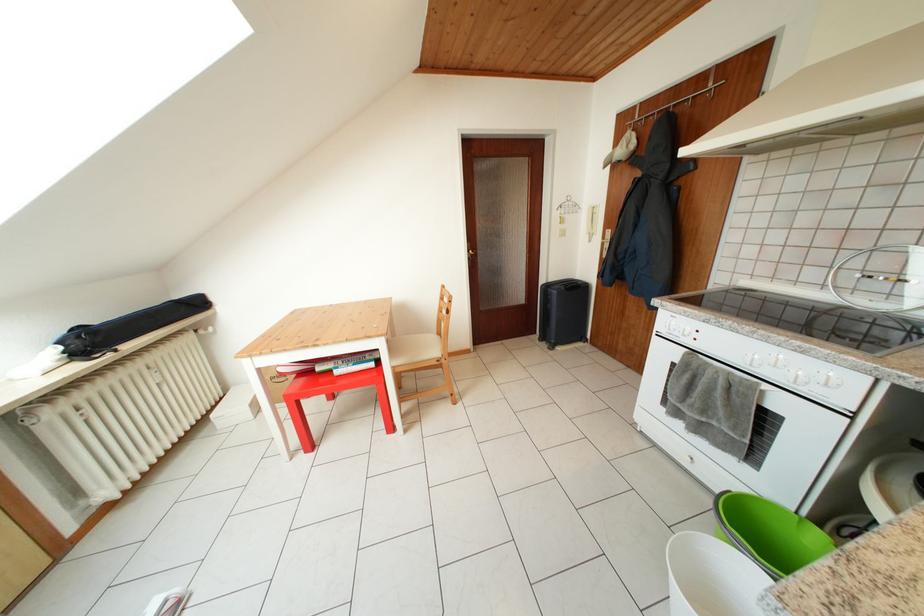
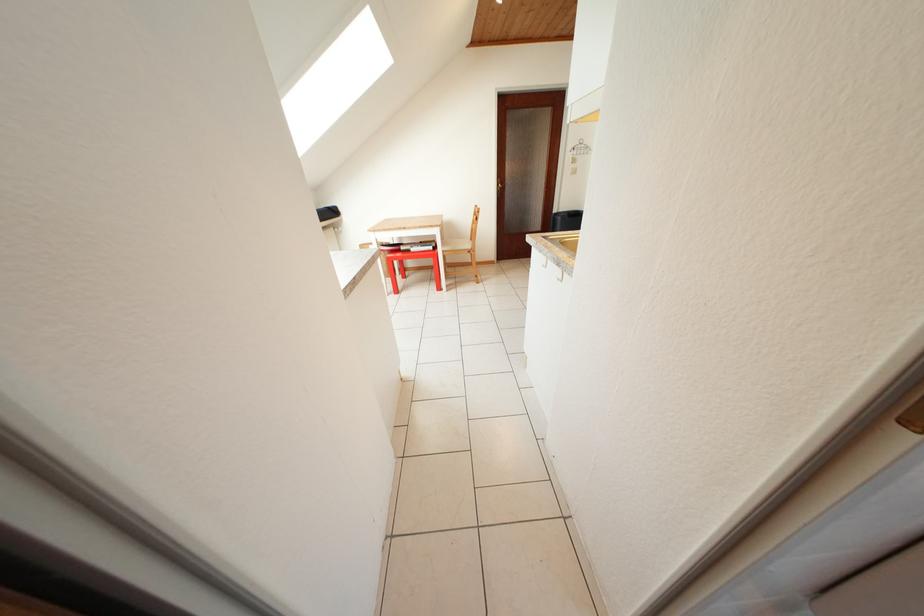
Where in the second image is the point corresponding to (564,211) from the first image?

(578, 153)